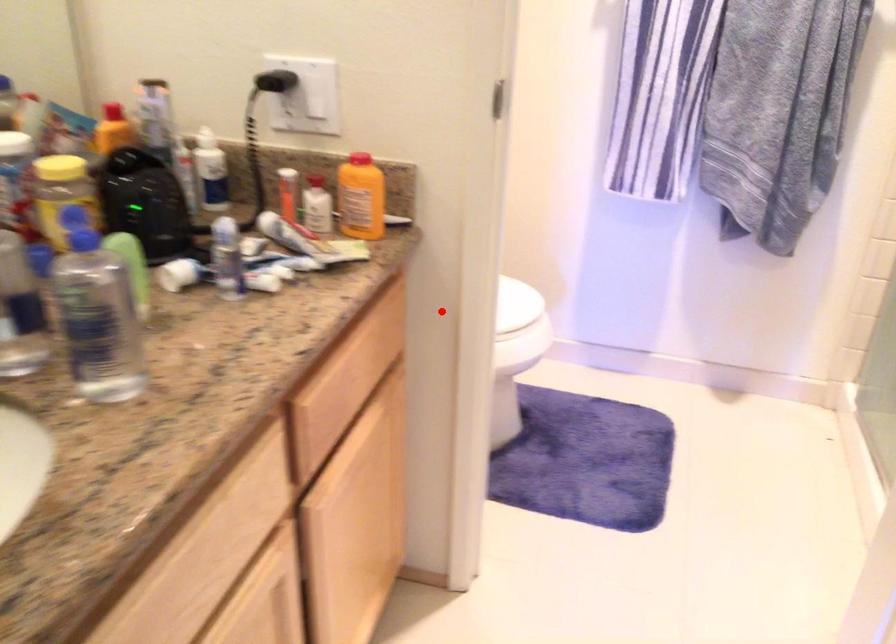
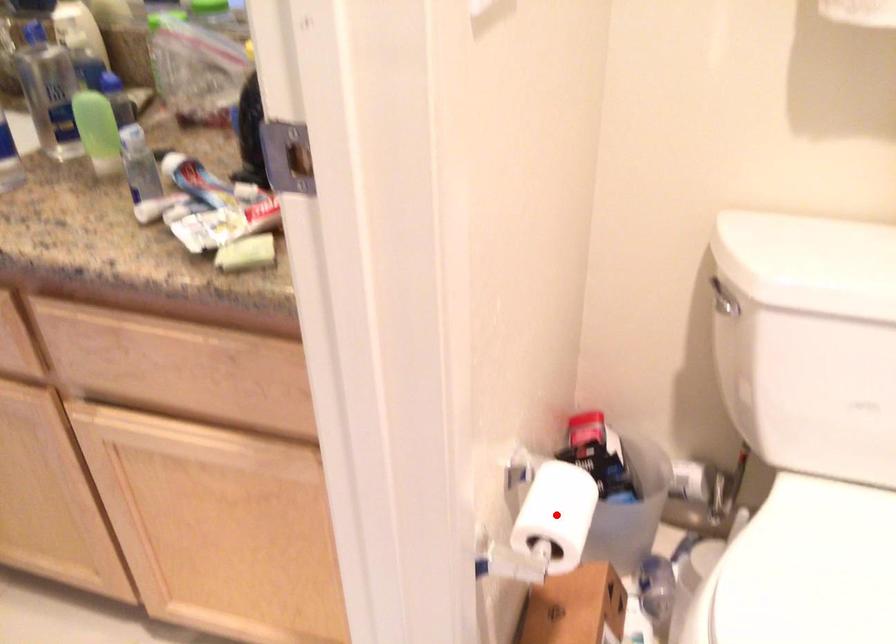
I am providing you with two images of the same scene from different viewpoints. A red point is marked on the first image and another point is marked on the second image. Do the highlighted points in image1 and image2 indicate the same real-world spot?

Yes